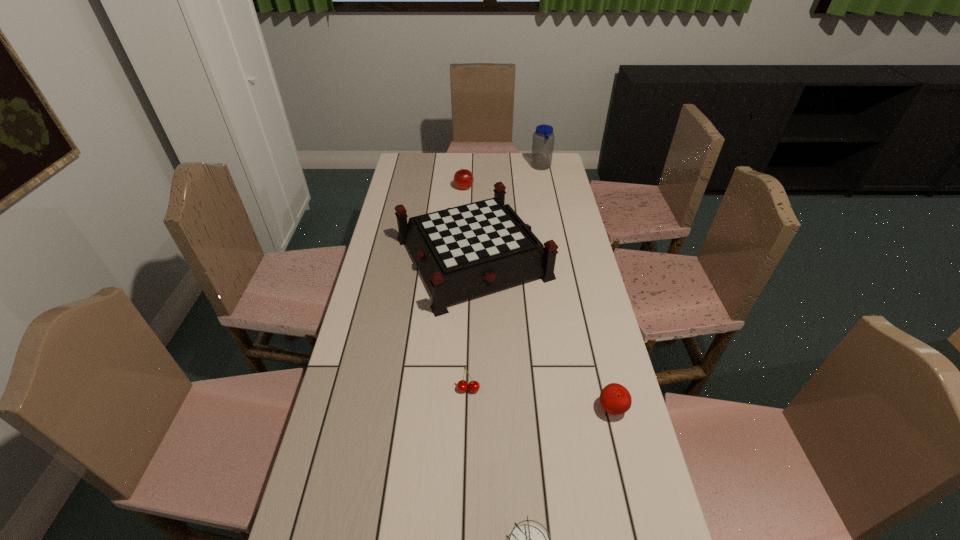
Locate an element on the screen. Image resolution: width=960 pixels, height=540 pixels. the tallest object is located at coordinates (543, 138).

This screenshot has height=540, width=960. What are the coordinates of `water bottle` in the screenshot? It's located at (543, 138).

Locate an element on the screen. The height and width of the screenshot is (540, 960). the third farthest object is located at coordinates (462, 252).

At what (x,y) coordinates should I click in order to perform the action: click on checkerboard. Please return your answer as a coordinate pair (x, y). The height and width of the screenshot is (540, 960). Looking at the image, I should click on (462, 252).

This screenshot has width=960, height=540. What are the coordinates of `the farther apple` in the screenshot? It's located at click(x=463, y=179).

Find the location of `the left apple`. the left apple is located at coordinates (463, 179).

Identify the location of cherry. (462, 386).

Where is `the right apple`? The height and width of the screenshot is (540, 960). the right apple is located at coordinates (615, 399).

Identify the location of the fifth farthest object. The image size is (960, 540). point(615,399).

What are the coordinates of `free point located with a carrying loop on the side of the tallest object` in the screenshot? It's located at (512, 167).